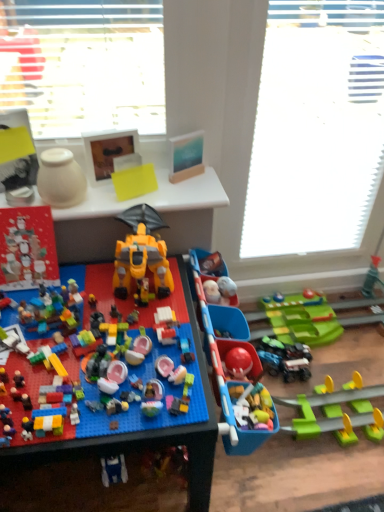
The height and width of the screenshot is (512, 384). What do you see at coordinates (151, 197) in the screenshot? I see `yellow plastic table at upper center` at bounding box center [151, 197].

Measure the distance between yellow plastic table at upper center and camera.

The distance of yellow plastic table at upper center from camera is 3.57 feet.

The image size is (384, 512). What do you see at coordinates (225, 359) in the screenshot?
I see `green plastic train at right, marked as the 1th toy in a right-to-left arrangement` at bounding box center [225, 359].

Describe the element at coordinates (141, 255) in the screenshot. I see `yellow plastic robot at center, which appears as the 4th toy when viewed from the left` at that location.

The height and width of the screenshot is (512, 384). Describe the element at coordinates (133, 417) in the screenshot. I see `translucent plastic spaceship at center, arranged as the third toy when viewed from the right` at that location.

This screenshot has height=512, width=384. I want to click on white matte vase at upper left, arranged as the 4th toy when viewed from the right, so click(60, 179).

Is white matte vase at upper left, arranged as the 4th toy when viewed from the right, turned away from yellow plastic robot at center, which appears as the 4th toy when viewed from the left?

No, white matte vase at upper left, arranged as the 4th toy when viewed from the right, is not facing away from yellow plastic robot at center, which appears as the 4th toy when viewed from the left.

From a real-world perspective, which is physically above, white matte vase at upper left, the second toy viewed from the left, or yellow plastic robot at center, which appears as the 4th toy when viewed from the left?

white matte vase at upper left, the second toy viewed from the left, is physically above.

From the yellow plastic robot at center, acting as the second toy starting from the right, count 3rd toys backward and point to it. Please provide its 2D coordinates.

[(60, 179)]

From their relative heights in the image, would you say white matte vase at upper left, arranged as the 4th toy when viewed from the right, is taller or shorter than yellow plastic robot at center, acting as the second toy starting from the right?

white matte vase at upper left, arranged as the 4th toy when viewed from the right, is shorter than yellow plastic robot at center, acting as the second toy starting from the right.

Image resolution: width=384 pixels, height=512 pixels. I want to click on the 2nd toy in front of the white matte vase at upper left, the second toy viewed from the left, so click(225, 359).

Is white matte vase at upper left, arranged as the 4th toy when viewed from the right, next to green plastic train at right, marked as the 1th toy in a right-to-left arrangement, and touching it?

white matte vase at upper left, arranged as the 4th toy when viewed from the right, and green plastic train at right, marked as the 1th toy in a right-to-left arrangement, are clearly separated.

Would you say white matte vase at upper left, the second toy viewed from the left, is to the left or to the right of green plastic train at right, marked as the 1th toy in a right-to-left arrangement, in the picture?

white matte vase at upper left, the second toy viewed from the left, is to the left of green plastic train at right, marked as the 1th toy in a right-to-left arrangement.

From the image's perspective, which one is positioned lower, white matte vase at upper left, the second toy viewed from the left, or green plastic train at right, the fifth toy in the left-to-right sequence?

green plastic train at right, the fifth toy in the left-to-right sequence.

Where is `the 2nd toy positioned below the yellow plastic robot at center, acting as the second toy starting from the right (from a real-world perspective)`? This screenshot has width=384, height=512. the 2nd toy positioned below the yellow plastic robot at center, acting as the second toy starting from the right (from a real-world perspective) is located at coordinates (225, 359).

From the image's perspective, which one is positioned lower, green plastic train at right, marked as the 1th toy in a right-to-left arrangement, or yellow plastic robot at center, which appears as the 4th toy when viewed from the left?

green plastic train at right, marked as the 1th toy in a right-to-left arrangement.

Are green plastic train at right, the fifth toy in the left-to-right sequence, and yellow plastic robot at center, which appears as the 4th toy when viewed from the left, far apart?

No, green plastic train at right, the fifth toy in the left-to-right sequence, is in close proximity to yellow plastic robot at center, which appears as the 4th toy when viewed from the left.

Looking at the image, does green plastic train at right, the fifth toy in the left-to-right sequence, seem bigger or smaller compared to yellow plastic robot at center, acting as the second toy starting from the right?

Considering their sizes, green plastic train at right, the fifth toy in the left-to-right sequence, takes up more space than yellow plastic robot at center, acting as the second toy starting from the right.

Can we say white matte vase at upper left, arranged as the 4th toy when viewed from the right, lies outside white textured window screen at upper center?

Yes, white matte vase at upper left, arranged as the 4th toy when viewed from the right, is outside of white textured window screen at upper center.

Is white matte vase at upper left, the second toy viewed from the left, not close to white textured window screen at upper center?

white matte vase at upper left, the second toy viewed from the left, is actually quite close to white textured window screen at upper center.

Which of these two, white matte vase at upper left, arranged as the 4th toy when viewed from the right, or white textured window screen at upper center, is bigger?

With larger size is white textured window screen at upper center.

Relative to white textured window screen at upper center, is white matte vase at upper left, arranged as the 4th toy when viewed from the right, in front or behind?

Visually, white matte vase at upper left, arranged as the 4th toy when viewed from the right, is located in front of white textured window screen at upper center.

Can you confirm if green plastic train at right, the fifth toy in the left-to-right sequence, is smaller than yellow plastic table at upper center?

No, green plastic train at right, the fifth toy in the left-to-right sequence, is not smaller than yellow plastic table at upper center.

Considering the relative sizes of green plastic train at right, the fifth toy in the left-to-right sequence, and yellow plastic table at upper center in the image provided, is green plastic train at right, the fifth toy in the left-to-right sequence, shorter than yellow plastic table at upper center?

No, green plastic train at right, the fifth toy in the left-to-right sequence, is not shorter than yellow plastic table at upper center.

Is green plastic train at right, marked as the 1th toy in a right-to-left arrangement, in contact with yellow plastic table at upper center?

There is a gap between green plastic train at right, marked as the 1th toy in a right-to-left arrangement, and yellow plastic table at upper center.

Is point (315, 401) closer to camera compared to point (205, 184)?

No, (315, 401) is behind (205, 184).

From a real-world perspective, which object stands above the other?

white matte vase at upper left, the second toy viewed from the left.

Is matte red advent calendar at left, the fifth toy when ordered from right to left, outside of white matte vase at upper left, the second toy viewed from the left?

Indeed, matte red advent calendar at left, the fifth toy when ordered from right to left, is completely outside white matte vase at upper left, the second toy viewed from the left.

Which of these two, matte red advent calendar at left, the 1th toy in the left-to-right sequence, or white matte vase at upper left, the second toy viewed from the left, is thinner?

Thinner between the two is matte red advent calendar at left, the 1th toy in the left-to-right sequence.

Could you tell me if matte red advent calendar at left, the 1th toy in the left-to-right sequence, is facing white matte vase at upper left, the second toy viewed from the left?

No, matte red advent calendar at left, the 1th toy in the left-to-right sequence, is not turned towards white matte vase at upper left, the second toy viewed from the left.

Could you measure the distance between translucent plastic spaceship at center, arranged as the third toy when viewed from the right, and green plastic train at right, marked as the 1th toy in a right-to-left arrangement?

translucent plastic spaceship at center, arranged as the third toy when viewed from the right, is 19.06 centimeters from green plastic train at right, marked as the 1th toy in a right-to-left arrangement.

From a real-world perspective, relative to green plastic train at right, marked as the 1th toy in a right-to-left arrangement, is translucent plastic spaceship at center, arranged as the third toy when viewed from the right, vertically above or below?

In terms of real-world spatial position, translucent plastic spaceship at center, arranged as the third toy when viewed from the right, is above green plastic train at right, marked as the 1th toy in a right-to-left arrangement.

Considering the sizes of objects translucent plastic spaceship at center, the 3th toy in the left-to-right sequence, and green plastic train at right, marked as the 1th toy in a right-to-left arrangement, in the image provided, who is thinner, translucent plastic spaceship at center, the 3th toy in the left-to-right sequence, or green plastic train at right, marked as the 1th toy in a right-to-left arrangement,?

translucent plastic spaceship at center, the 3th toy in the left-to-right sequence, is thinner.

The height and width of the screenshot is (512, 384). What are the coordinates of `the 2nd toy positioned below the white matte vase at upper left, arranged as the 4th toy when viewed from the right (from a real-world perspective)` in the screenshot? It's located at (141, 255).

Starting from the white matte vase at upper left, the second toy viewed from the left, which toy is the 2nd one in front? Please provide its 2D coordinates.

[(225, 359)]

Considering their positions, is white matte vase at upper left, arranged as the 4th toy when viewed from the right, positioned further to yellow plastic robot at center, which appears as the 4th toy when viewed from the left, than white textured window screen at upper center?

white textured window screen at upper center is further to yellow plastic robot at center, which appears as the 4th toy when viewed from the left.

When comparing their distances from yellow plastic table at upper center, does white textured window screen at upper center or white matte vase at upper left, arranged as the 4th toy when viewed from the right, seem further?

white textured window screen at upper center lies further to yellow plastic table at upper center than the other object.

When comparing their distances from yellow plastic robot at center, which appears as the 4th toy when viewed from the left, does translucent plastic spaceship at center, arranged as the third toy when viewed from the right, or white matte vase at upper left, the second toy viewed from the left, seem closer?

translucent plastic spaceship at center, arranged as the third toy when viewed from the right, lies closer to yellow plastic robot at center, which appears as the 4th toy when viewed from the left, than the other object.

Looking at the image, which one is located closer to yellow plastic robot at center, acting as the second toy starting from the right, matte red advent calendar at left, the fifth toy when ordered from right to left, or white matte vase at upper left, the second toy viewed from the left?

white matte vase at upper left, the second toy viewed from the left, is positioned closer to the anchor yellow plastic robot at center, acting as the second toy starting from the right.

Estimate the real-world distances between objects in this image. Which object is closer to green plastic train at right, the fifth toy in the left-to-right sequence, matte red advent calendar at left, the 1th toy in the left-to-right sequence, or white textured window screen at upper center?

matte red advent calendar at left, the 1th toy in the left-to-right sequence.

Considering their positions, is translucent plastic spaceship at center, the 3th toy in the left-to-right sequence, positioned further to yellow plastic robot at center, which appears as the 4th toy when viewed from the left, than matte red advent calendar at left, the 1th toy in the left-to-right sequence?

matte red advent calendar at left, the 1th toy in the left-to-right sequence, is further to yellow plastic robot at center, which appears as the 4th toy when viewed from the left.

Based on their spatial positions, is white matte vase at upper left, the second toy viewed from the left, or translucent plastic spaceship at center, arranged as the third toy when viewed from the right, closer to white textured window screen at upper center?

translucent plastic spaceship at center, arranged as the third toy when viewed from the right, is positioned closer to the anchor white textured window screen at upper center.

When comparing their distances from translucent plastic spaceship at center, arranged as the third toy when viewed from the right, does white matte vase at upper left, arranged as the 4th toy when viewed from the right, or matte red advent calendar at left, the 1th toy in the left-to-right sequence, seem closer?

matte red advent calendar at left, the 1th toy in the left-to-right sequence.

The height and width of the screenshot is (512, 384). In order to click on window screen situated between yellow plastic robot at center, acting as the second toy starting from the right, and green plastic train at right, the fifth toy in the left-to-right sequence, from left to right in this screenshot , I will do tap(316, 128).

The width and height of the screenshot is (384, 512). I want to click on table between matte red advent calendar at left, the fifth toy when ordered from right to left, and green plastic train at right, marked as the 1th toy in a right-to-left arrangement, in the horizontal direction, so click(151, 197).

Locate an element on the screen. The width and height of the screenshot is (384, 512). toy between translucent plastic spaceship at center, arranged as the third toy when viewed from the right, and white textured window screen at upper center is located at coordinates (141, 255).

You are a GUI agent. You are given a task and a screenshot of the screen. Output one action in this format:
    pyautogui.click(x=<x>, y=<y>)
    Task: Click on the table situated between white matte vase at upper left, the second toy viewed from the left, and white textured window screen at upper center from left to right
    The height and width of the screenshot is (512, 384).
    Given the screenshot: What is the action you would take?
    pyautogui.click(x=151, y=197)